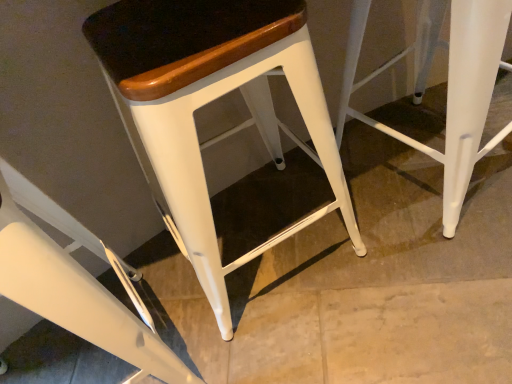
Find the location of a particular element. free space above white painted wood stool at center (from a real-world perspective) is located at coordinates (165, 29).